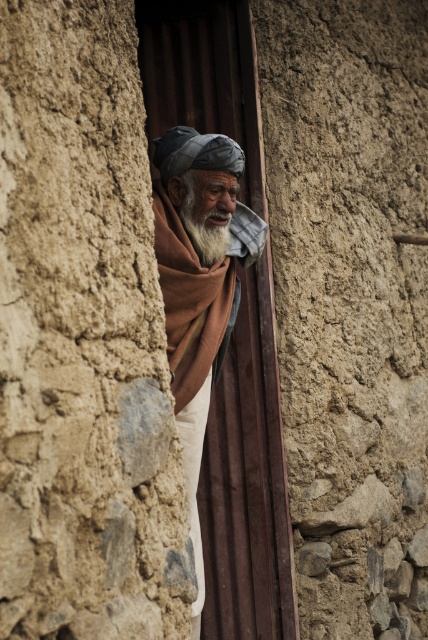
Based on the photo, you are an anthropologist observing the elderly man in the rustic stone doorway. You notice two brown scarves at the center of the image. Which one is physically nearer to you, the brown woolen scarf at center or the brown woven scarf at center?

The brown woolen scarf at center is closer to the viewer than the brown woven scarf at center.